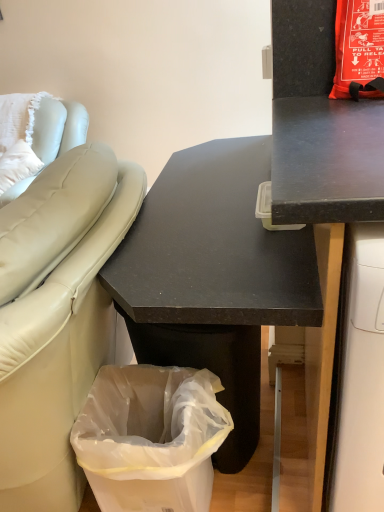
This screenshot has height=512, width=384. Find the location of `blank space situated above black matte desk at upper right, the first desk positioned from the right (from a real-world perspective)`. blank space situated above black matte desk at upper right, the first desk positioned from the right (from a real-world perspective) is located at coordinates (337, 134).